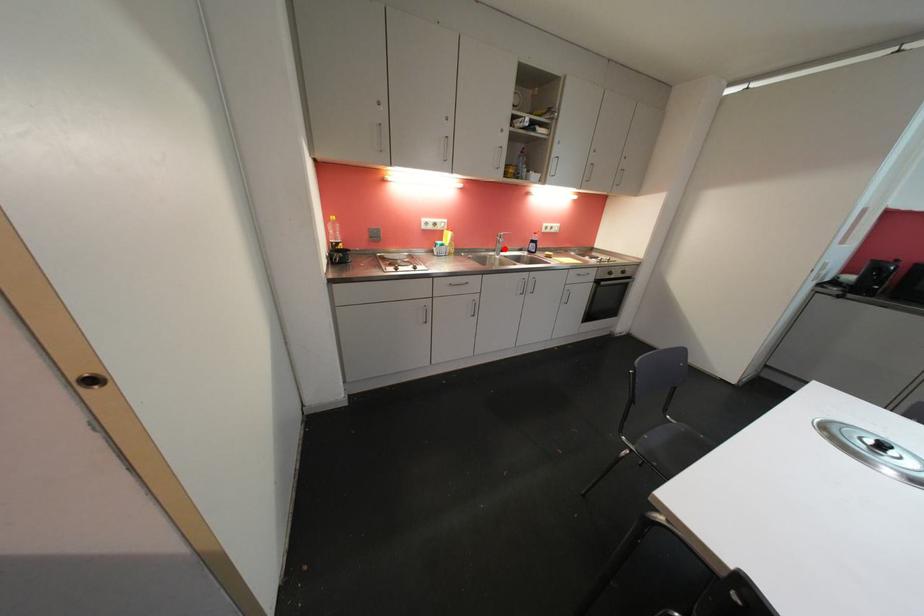
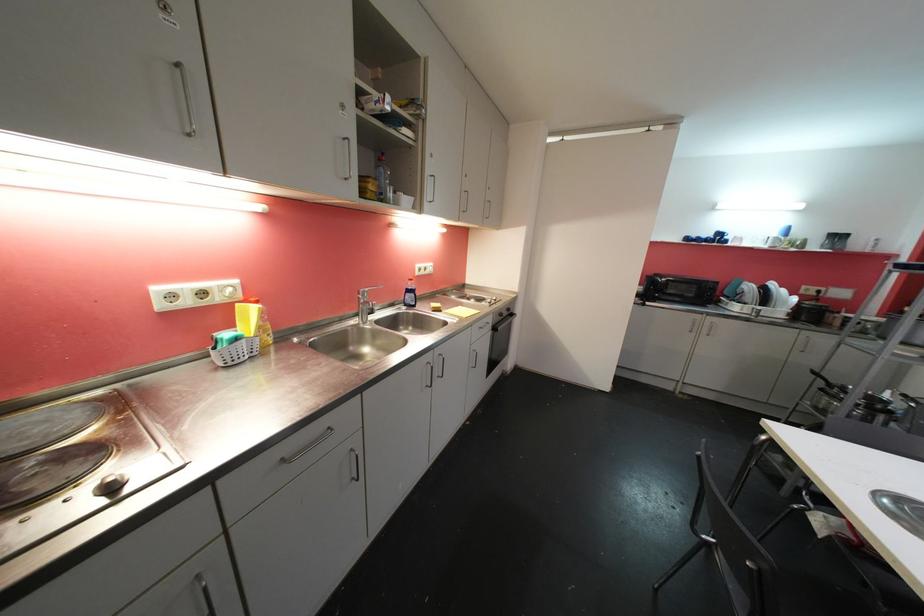
Where in the second image is the point corresponding to the highlighted location from the first image?

(370, 310)